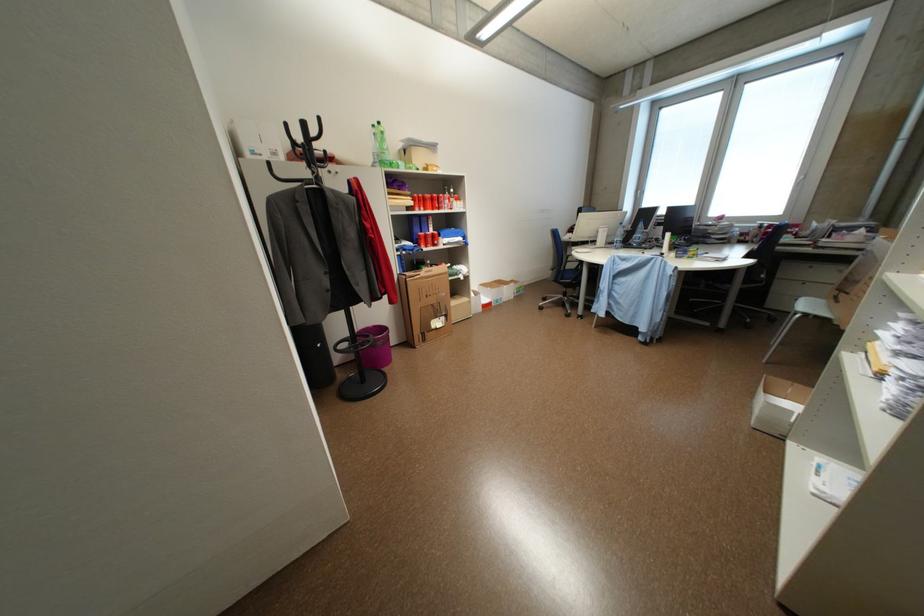
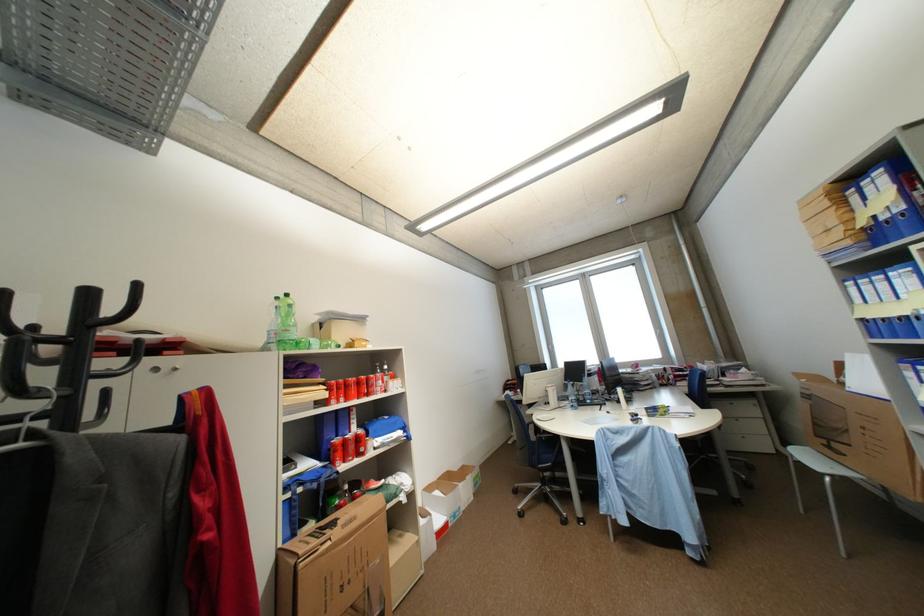
Locate, in the second image, the point that corresponds to the point at 492,286 in the first image.

(438, 490)